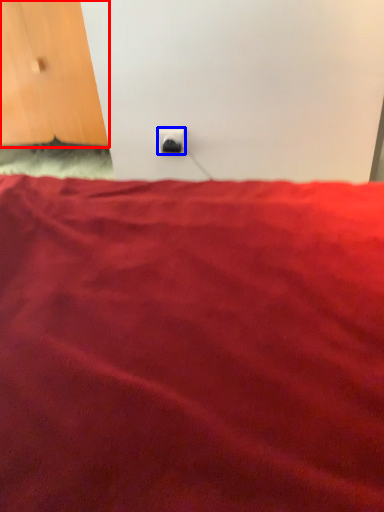
Question: Which object is further to the camera taking this photo, door (highlighted by a red box) or power plugs and sockets (highlighted by a blue box)?

Choices:
 (A) door
 (B) power plugs and sockets

Answer: (A)